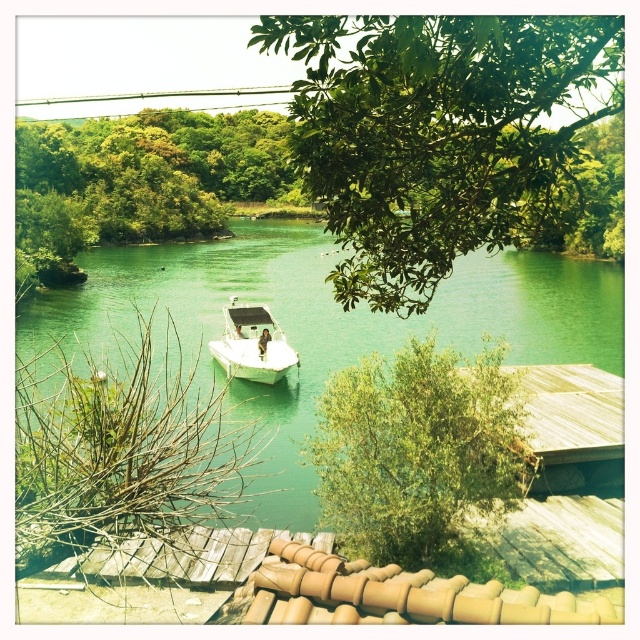
Who is taller, green leafy tree at upper center or green glossy water at center?

green glossy water at center is taller.

Is point (330, 179) less distant than point (125, 310)?

Yes, point (330, 179) is closer to viewer.

What do you see at coordinates (436, 134) in the screenshot? Image resolution: width=640 pixels, height=640 pixels. I see `green leafy tree at upper center` at bounding box center [436, 134].

Locate an element on the screen. This screenshot has height=640, width=640. green leafy tree at upper center is located at coordinates (436, 134).

Between point (301, 506) and point (285, 349), which one is positioned in front?

Point (301, 506) is more forward.

Is green glossy water at center positioned in front of white glossy boat at center?

Yes, green glossy water at center is closer to the viewer.

Is point (477, 326) farther from viewer compared to point (221, 365)?

Yes, point (477, 326) is farther from viewer.

Where is `green glossy water at center`? The width and height of the screenshot is (640, 640). green glossy water at center is located at coordinates (321, 324).

Is point (346, 237) farther from viewer compared to point (234, 304)?

No, it is not.

Can you confirm if green leafy tree at upper center is wider than white glossy boat at center?

Correct, the width of green leafy tree at upper center exceeds that of white glossy boat at center.

You are a GUI agent. You are given a task and a screenshot of the screen. Output one action in this format:
    pyautogui.click(x=<x>, y=<y>)
    Task: Click on the green leafy tree at upper center
    The height and width of the screenshot is (640, 640).
    Given the screenshot: What is the action you would take?
    pyautogui.click(x=436, y=134)

Locate an element on the screen. The image size is (640, 640). green leafy tree at upper center is located at coordinates (436, 134).